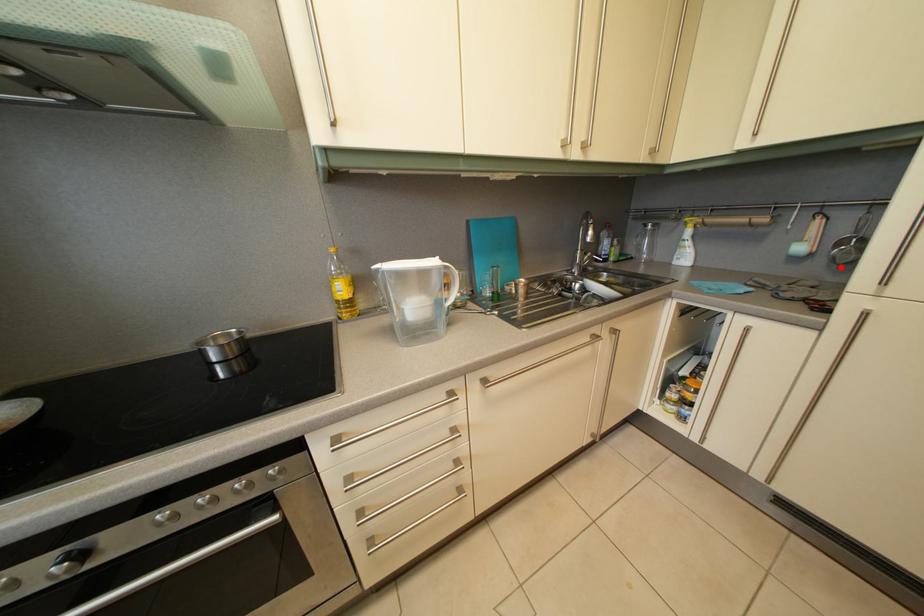
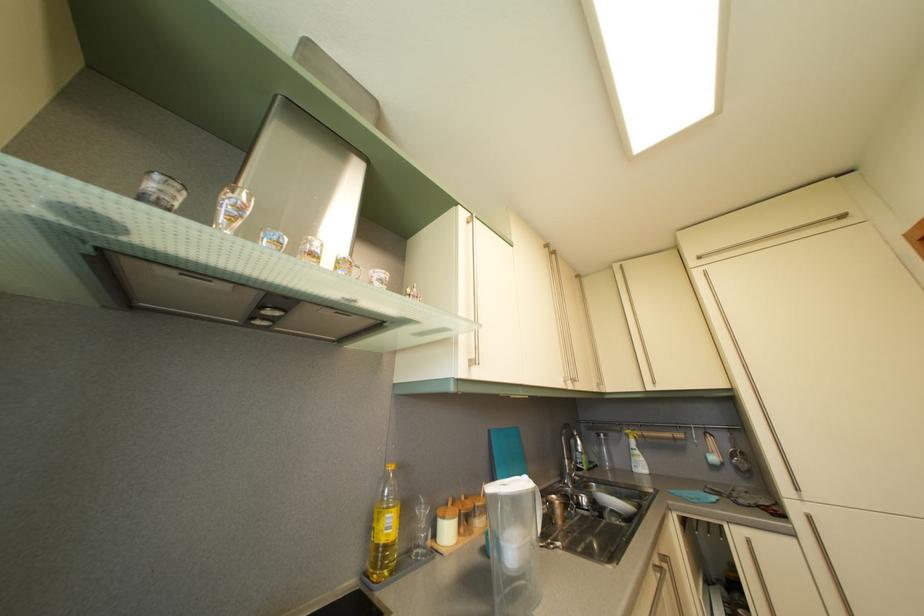
Locate, in the second image, the point that corresponds to the highlighted location in the first image.

(746, 476)